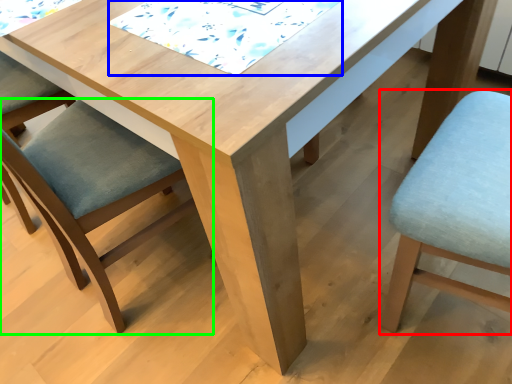
Question: Estimate the real-world distances between objects in this image. Which object is closer to chair (highlighted by a red box), quilt (highlighted by a blue box) or chair (highlighted by a green box)?

Choices:
 (A) quilt
 (B) chair

Answer: (A)